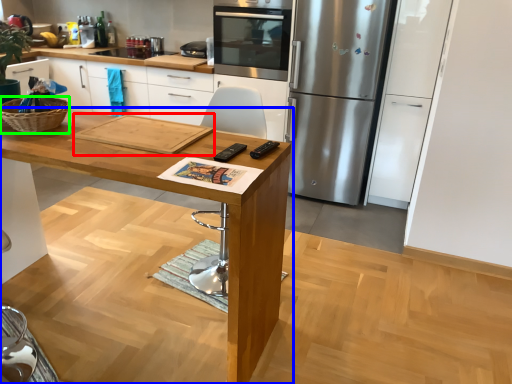
Question: Considering the real-world distances, which object is closest to cutting board (highlighted by a red box)? table (highlighted by a blue box) or basket (highlighted by a green box).

Choices:
 (A) table
 (B) basket

Answer: (A)